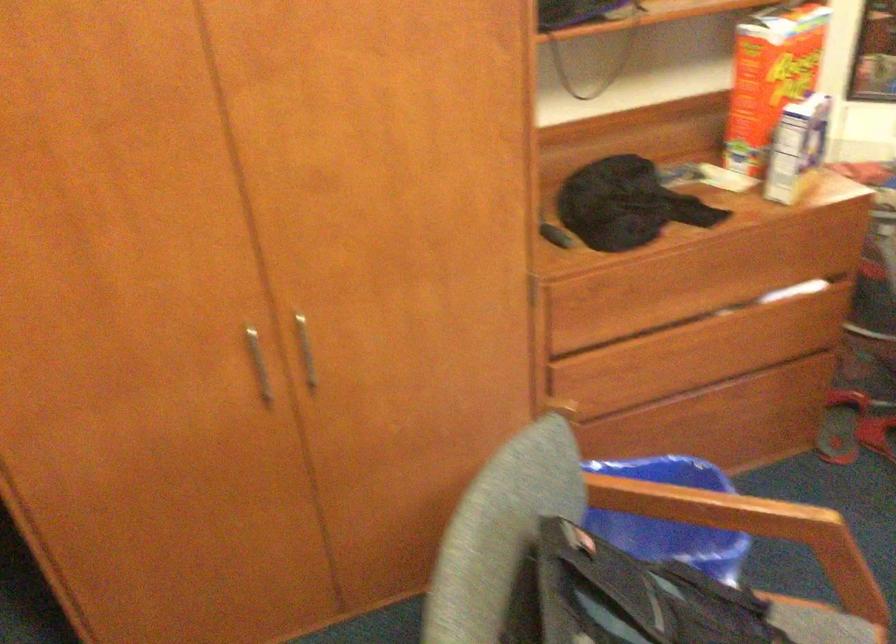
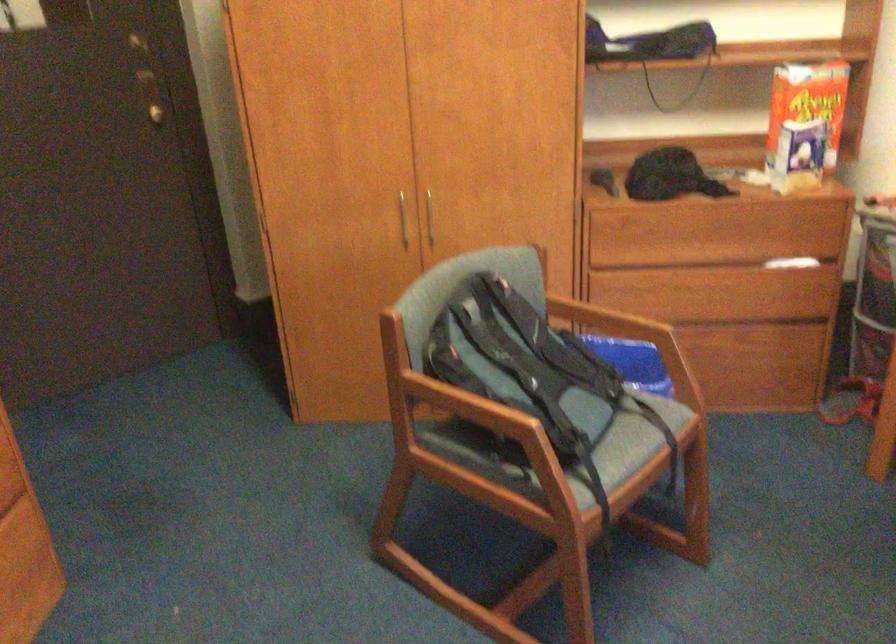
Which direction would the cameraman need to move to produce the second image?

The cameraman moved toward right, backward.